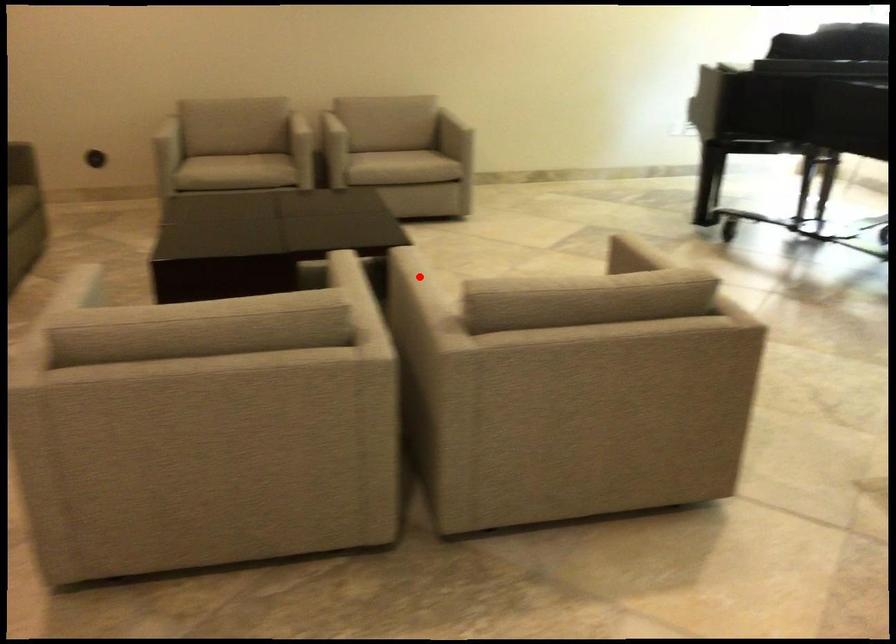
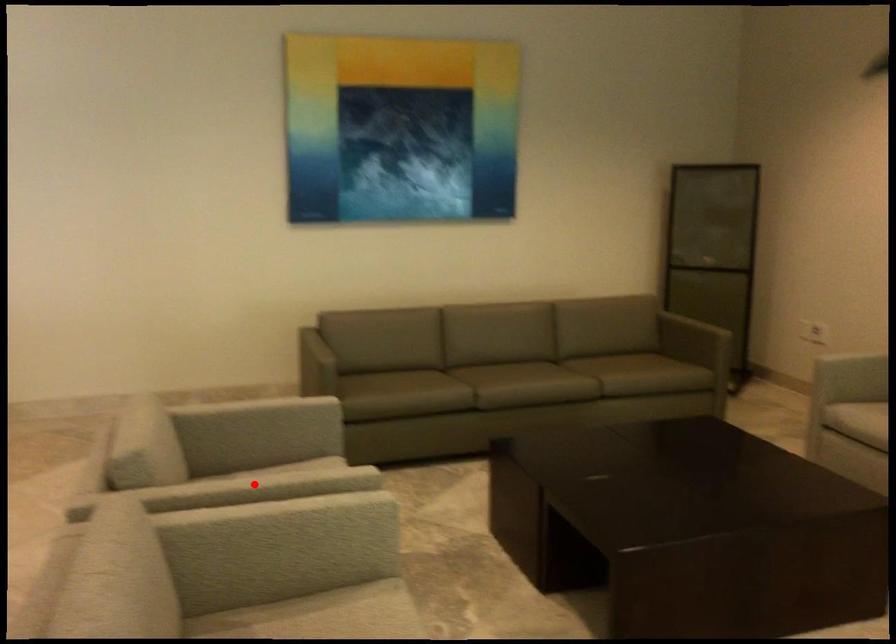
I am providing you with two images of the same scene from different viewpoints. A red point is marked on the first image and another point is marked on the second image. Do the highlighted points in image1 and image2 indicate the same real-world spot?

No